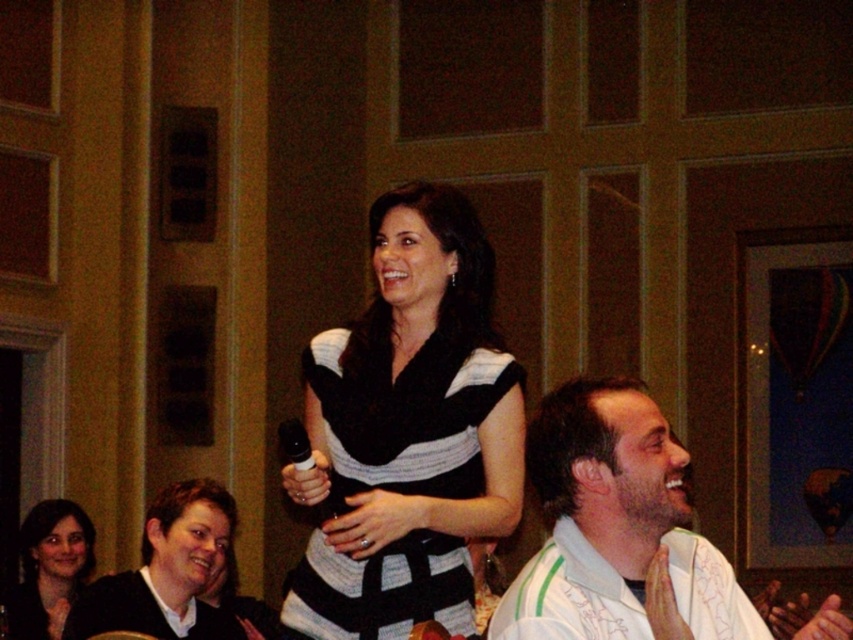
Question: Among these points, which one is farthest from the camera?

Choices:
 (A) (373, 461)
 (B) (218, 560)
 (C) (50, 632)

Answer: (C)

Question: Which object appears farthest from the camera in this image?

Choices:
 (A) black and white striped dress at center
 (B) matte black sweater at lower left
 (C) white textured shirt at lower right
 (D) smooth skin face at lower left

Answer: (D)

Question: Can you confirm if white textured shirt at lower right is positioned to the right of smooth skin face at lower left?

Choices:
 (A) no
 (B) yes

Answer: (B)

Question: Is the position of black and white striped dress at center more distant than that of smooth skin face at lower left?

Choices:
 (A) yes
 (B) no

Answer: (B)

Question: Does matte black sweater at lower left appear on the right side of smooth skin face at lower left?

Choices:
 (A) no
 (B) yes

Answer: (B)

Question: Which object is the farthest from the smooth skin face at lower left?

Choices:
 (A) black and white striped dress at center
 (B) matte black sweater at lower left

Answer: (A)